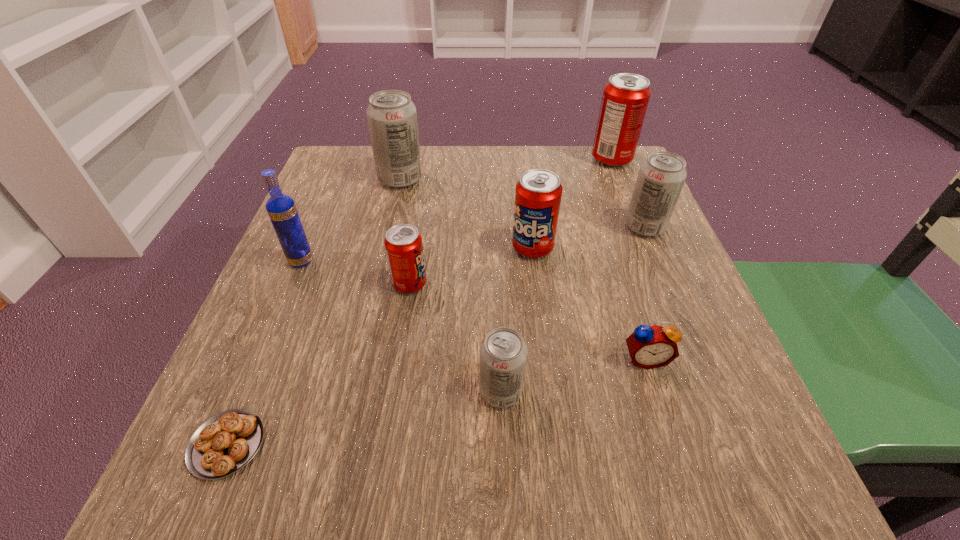
The height and width of the screenshot is (540, 960). I want to click on the rightmost red soda can, so click(x=625, y=98).

Where is `the farthest red soda can`? the farthest red soda can is located at coordinates pyautogui.click(x=625, y=98).

Locate an element on the screen. The image size is (960, 540). the leftmost gray soda can is located at coordinates (392, 117).

I want to click on the biggest gray soda can, so click(x=392, y=117).

This screenshot has width=960, height=540. Identify the location of vodka. (282, 211).

The width and height of the screenshot is (960, 540). I want to click on the second nearest gray soda can, so click(x=661, y=177).

In order to click on the second smallest gray soda can in this screenshot , I will do `click(661, 177)`.

Where is `the fourth soda can from left to right`? The height and width of the screenshot is (540, 960). the fourth soda can from left to right is located at coordinates (538, 194).

You are a GUI agent. You are given a task and a screenshot of the screen. Output one action in this format:
    pyautogui.click(x=<x>, y=<y>)
    Task: Click on the fourth object from right to left
    The height and width of the screenshot is (540, 960).
    Given the screenshot: What is the action you would take?
    pyautogui.click(x=538, y=194)

Locate an element on the screen. Image resolution: width=960 pixels, height=540 pixels. the fourth nearest object is located at coordinates (403, 243).